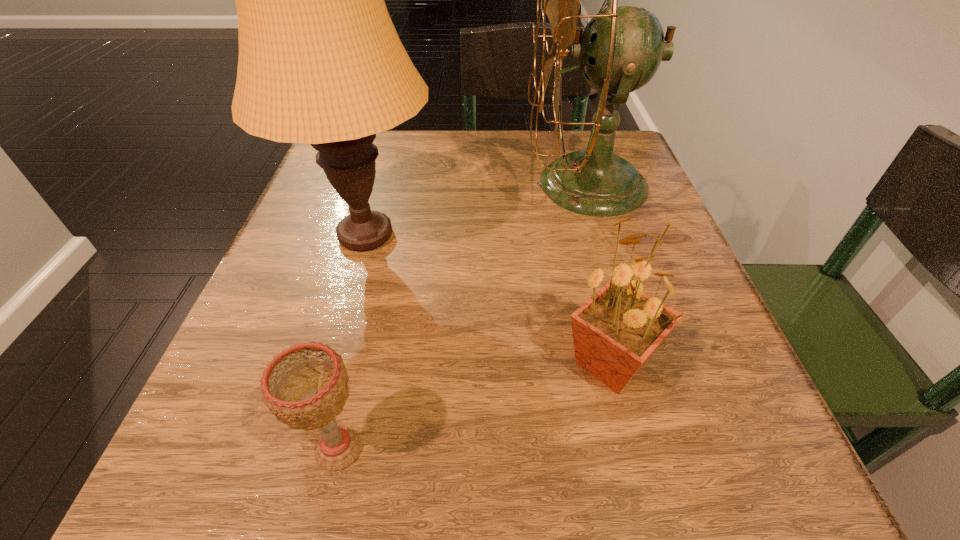
I want to click on free space between the shortest object and the fan, so click(x=463, y=317).

Where is `free point between the sunflower and the nearest object`? The height and width of the screenshot is (540, 960). free point between the sunflower and the nearest object is located at coordinates (475, 407).

Where is `vacant space in between the fan and the lampshade`? vacant space in between the fan and the lampshade is located at coordinates 476,210.

The image size is (960, 540). I want to click on vacant space that's between the nearest object and the third farthest object, so click(475, 407).

The width and height of the screenshot is (960, 540). Identify the location of free space between the nearest object and the fan. (463, 317).

Image resolution: width=960 pixels, height=540 pixels. I want to click on free space between the lampshade and the nearest object, so pyautogui.click(x=352, y=342).

Identify which object is located as the nearest to the sunflower. Please provide its 2D coordinates. Your answer should be formatted as a tuple, i.e. [(x, y)], where the tuple contains the x and y coordinates of a point satisfying the conditions above.

[(621, 48)]

This screenshot has width=960, height=540. What are the coordinates of `object that stands as the second closest to the lampshade` in the screenshot? It's located at (615, 332).

The width and height of the screenshot is (960, 540). Find the location of `free space in the image that satisfies the following two spatial constraints: 1. in front of the fan, directing air flow; 2. on the front side of the lampshade`. free space in the image that satisfies the following two spatial constraints: 1. in front of the fan, directing air flow; 2. on the front side of the lampshade is located at coordinates (602, 235).

Identify the location of free spot that satisfies the following two spatial constraints: 1. in front of the fan, directing air flow; 2. on the front side of the lampshade. 602,235.